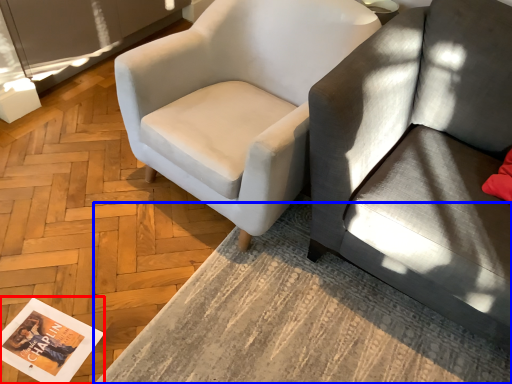
Question: Which object is closer to the camera taking this photo, magazine (highlighted by a red box) or table (highlighted by a blue box)?

Choices:
 (A) magazine
 (B) table

Answer: (B)